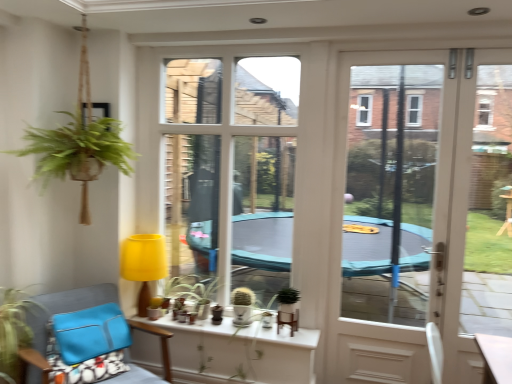
Question: Is the depth of white glass door at right less than that of green matte plant at lower left, the 2th houseplant viewed from the back?

Choices:
 (A) yes
 (B) no

Answer: (B)

Question: Is white glass door at right placed right next to green matte plant at lower left, arranged as the 1th houseplant when viewed from the front?

Choices:
 (A) yes
 (B) no

Answer: (B)

Question: Considering the relative sizes of white glass door at right and green matte plant at lower left, the 2th houseplant viewed from the back, in the image provided, is white glass door at right smaller than green matte plant at lower left, the 2th houseplant viewed from the back,?

Choices:
 (A) yes
 (B) no

Answer: (B)

Question: Does white glass door at right have a greater width compared to green matte plant at lower left, the second houseplant viewed from the right?

Choices:
 (A) yes
 (B) no

Answer: (B)

Question: Is white glass door at right not near green matte plant at lower left, arranged as the 1th houseplant when viewed from the front?

Choices:
 (A) yes
 (B) no

Answer: (A)

Question: Considering the positions of point (39, 380) and point (227, 145), is point (39, 380) closer or farther from the camera than point (227, 145)?

Choices:
 (A) closer
 (B) farther

Answer: (A)

Question: Would you say blue fabric chair at lower left is to the left or to the right of transparent plastic window screen at center in the picture?

Choices:
 (A) left
 (B) right

Answer: (A)

Question: In the image, is blue fabric chair at lower left positioned in front of or behind transparent plastic window screen at center?

Choices:
 (A) behind
 (B) front

Answer: (B)

Question: Choose the correct answer: Is blue fabric chair at lower left inside transparent plastic window screen at center or outside it?

Choices:
 (A) outside
 (B) inside

Answer: (A)

Question: Is blue fabric chair at lower left wider or thinner than green matte plant at center?

Choices:
 (A) wide
 (B) thin

Answer: (A)

Question: Considering the positions of point (44, 302) and point (279, 301), is point (44, 302) closer or farther from the camera than point (279, 301)?

Choices:
 (A) closer
 (B) farther

Answer: (A)

Question: Considering the positions of blue fabric chair at lower left and green matte plant at center in the image, is blue fabric chair at lower left bigger or smaller than green matte plant at center?

Choices:
 (A) small
 (B) big

Answer: (B)

Question: Considering their positions, is blue fabric chair at lower left located in front of or behind green matte plant at center?

Choices:
 (A) front
 (B) behind

Answer: (A)

Question: Does point (79, 299) appear closer or farther from the camera than point (26, 342)?

Choices:
 (A) closer
 (B) farther

Answer: (B)

Question: In terms of height, does blue fabric chair at lower left look taller or shorter compared to green matte plant at lower left, which is the first houseplant in left-to-right order?

Choices:
 (A) tall
 (B) short

Answer: (A)